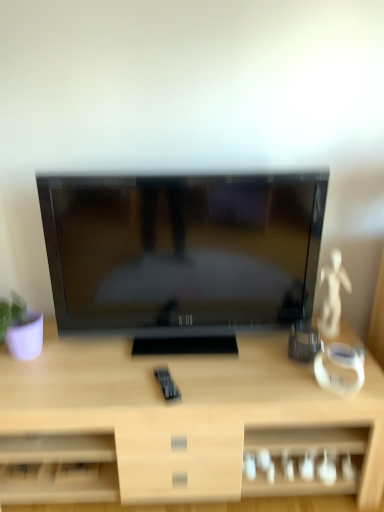
Image resolution: width=384 pixels, height=512 pixels. What do you see at coordinates (185, 257) in the screenshot?
I see `matte black tv at center` at bounding box center [185, 257].

You are a GUI agent. You are given a task and a screenshot of the screen. Output one action in this format:
    pyautogui.click(x=<x>, y=<y>)
    Task: Click on the matte black tv at center
    This screenshot has height=512, width=384.
    Given the screenshot: What is the action you would take?
    pyautogui.click(x=185, y=257)

Where is `light wood desk at center`? Image resolution: width=384 pixels, height=512 pixels. light wood desk at center is located at coordinates (174, 420).

The width and height of the screenshot is (384, 512). What do you see at coordinates (174, 420) in the screenshot?
I see `light wood desk at center` at bounding box center [174, 420].

Locate an element on the screen. The image size is (384, 512). matte black tv at center is located at coordinates (185, 257).

Which object is positioned more to the left, matte black tv at center or light wood desk at center?

light wood desk at center is more to the left.

Looking at this image, considering the relative positions of matte black tv at center and light wood desk at center in the image provided, is matte black tv at center in front of light wood desk at center?

No.

Considering the positions of point (202, 253) and point (105, 485), is point (202, 253) closer or farther from the camera than point (105, 485)?

Point (202, 253) is closer to the camera than point (105, 485).

From the image's perspective, does matte black tv at center appear higher than light wood desk at center?

Yes, from the image's perspective, matte black tv at center is on top of light wood desk at center.

From a real-world perspective, who is located lower, matte black tv at center or light wood desk at center?

light wood desk at center, from a real-world perspective.

Considering the sizes of objects matte black tv at center and light wood desk at center in the image provided, who is wider, matte black tv at center or light wood desk at center?

With larger width is light wood desk at center.

Considering the sizes of objects matte black tv at center and light wood desk at center in the image provided, who is shorter, matte black tv at center or light wood desk at center?

light wood desk at center.

Who is smaller, matte black tv at center or light wood desk at center?

matte black tv at center is smaller.

Is matte black tv at center situated inside light wood desk at center or outside?

matte black tv at center is outside light wood desk at center.

Consider the image. Is matte black tv at center not near light wood desk at center?

That's not correct — matte black tv at center is a little close to light wood desk at center.

Could you tell me if matte black tv at center is turned towards light wood desk at center?

No, matte black tv at center is not turned towards light wood desk at center.

Can you tell me how much matte black tv at center and light wood desk at center differ in facing direction?

The angle between the facing direction of matte black tv at center and the facing direction of light wood desk at center is 5.23e-05 degrees.

Locate an element on the screen. The width and height of the screenshot is (384, 512). desk in front of the matte black tv at center is located at coordinates (174, 420).

Which object is positioned more to the right, light wood desk at center or matte black tv at center?

matte black tv at center is more to the right.

Which object is more forward, light wood desk at center or matte black tv at center?

Positioned in front is light wood desk at center.

Which is nearer, (58, 444) or (69, 182)?

The point (69, 182) is in front.

From the image's perspective, is light wood desk at center under matte black tv at center?

Yes, from the image's perspective, light wood desk at center is beneath matte black tv at center.

From a real-world perspective, who is located higher, light wood desk at center or matte black tv at center?

matte black tv at center is physically above.

Is light wood desk at center thinner than matte black tv at center?

No.

Consider the image. Considering the relative sizes of light wood desk at center and matte black tv at center in the image provided, is light wood desk at center shorter than matte black tv at center?

Yes, light wood desk at center is shorter than matte black tv at center.

Can you confirm if light wood desk at center is bigger than matte black tv at center?

Yes.

Would you say light wood desk at center contains matte black tv at center?

No, matte black tv at center is not surrounded by light wood desk at center.

Are light wood desk at center and matte black tv at center beside each other?

No.

Is light wood desk at center looking in the opposite direction of matte black tv at center?

No, matte black tv at center is not at the back of light wood desk at center.

What's the angular difference between light wood desk at center and matte black tv at center's facing directions?

The angular difference between light wood desk at center and matte black tv at center is 5.23e-05 degrees.

The height and width of the screenshot is (512, 384). Identify the location of desk below the matte black tv at center (from the image's perspective). (174, 420).

You are a GUI agent. You are given a task and a screenshot of the screen. Output one action in this format:
    pyautogui.click(x=<x>, y=<y>)
    Task: Click on the television behind the light wood desk at center
    Image resolution: width=384 pixels, height=512 pixels.
    Given the screenshot: What is the action you would take?
    pyautogui.click(x=185, y=257)

Locate an element on the screen. The width and height of the screenshot is (384, 512). desk below the matte black tv at center (from the image's perspective) is located at coordinates (174, 420).